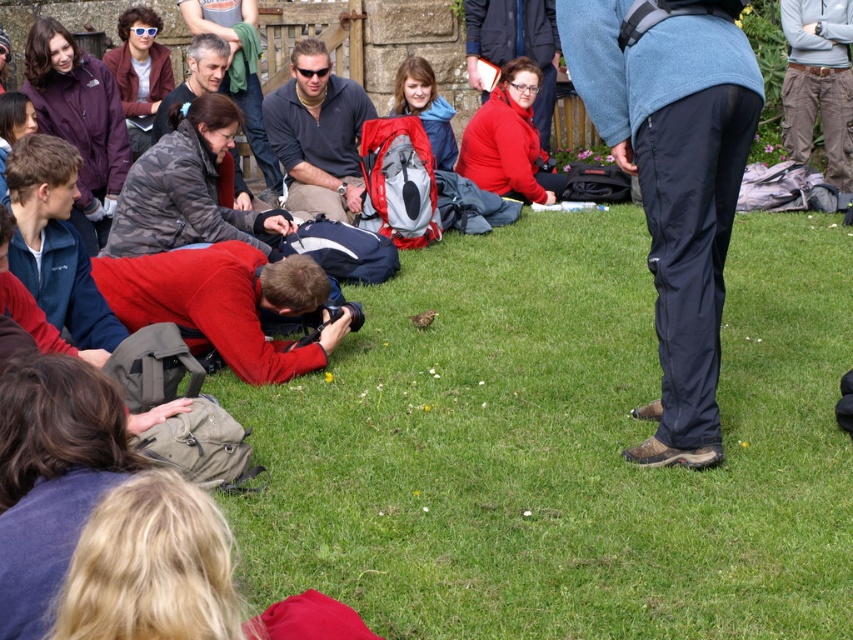
Does point (514, 305) come in front of point (276, 109)?

Yes, it is in front of point (276, 109).

Between point (799, 244) and point (317, 179), which one is positioned in front?

Point (799, 244)

You are a GUI agent. You are given a task and a screenshot of the screen. Output one action in this format:
    pyautogui.click(x=<x>, y=<y>)
    Task: Click on the green grass at center
    
    Given the screenshot: What is the action you would take?
    pyautogui.click(x=561, y=445)

Is sunglassesmaterial at center in front of matte red jacket at center?

Yes, it is.

Find the location of a particular element. sunglassesmaterial at center is located at coordinates (317, 134).

Locate an element on the screen. The image size is (853, 640). sunglassesmaterial at center is located at coordinates (317, 134).

The width and height of the screenshot is (853, 640). What do you see at coordinates (561, 445) in the screenshot?
I see `green grass at center` at bounding box center [561, 445].

Locate an element on the screen. The image size is (853, 640). green grass at center is located at coordinates (561, 445).